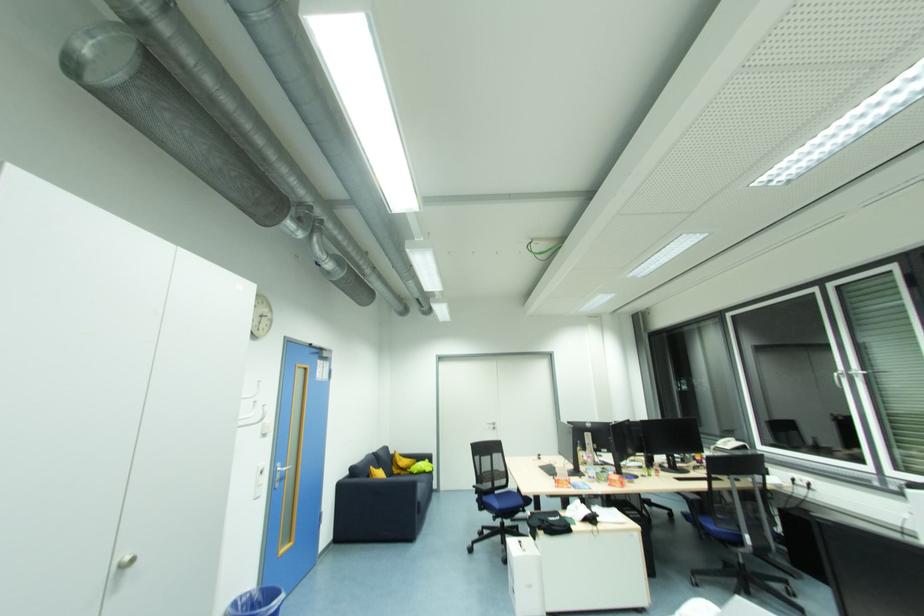
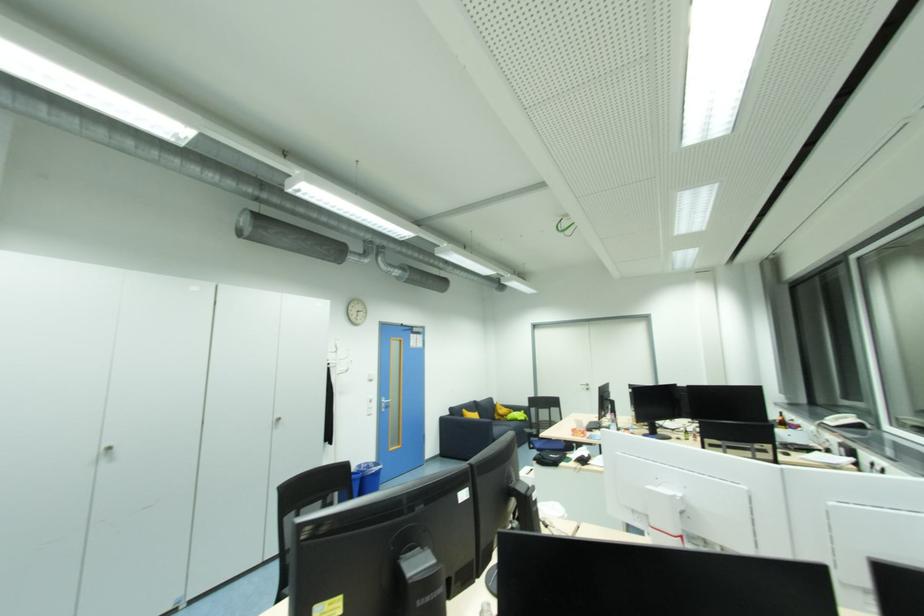
Where in the second image is the point corresponding to (x=343, y=487) from the first image?

(445, 421)